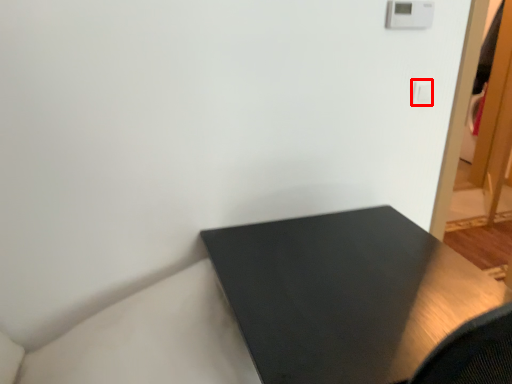
Question: From the image's perspective, what is the correct spatial positioning of light switch (annotated by the red box) in reference to table?

Choices:
 (A) above
 (B) below

Answer: (A)